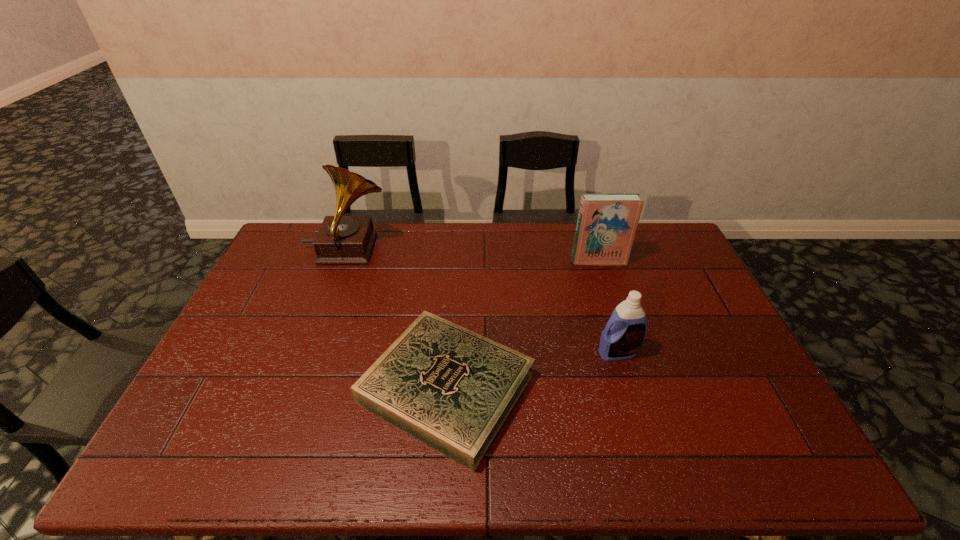
At what (x,y) coordinates should I click in order to perform the action: click on vacant region at the far right corner of the desktop. Please return your answer as a coordinate pair (x, y). Looking at the image, I should click on (x=656, y=244).

Locate an element on the screen. blank region between the third tallest object and the farther hardback book is located at coordinates (x=608, y=307).

I want to click on free space that is in between the farther hardback book and the second shortest object, so click(x=608, y=307).

Locate an element on the screen. Image resolution: width=960 pixels, height=540 pixels. free space between the shorter hardback book and the right hardback book is located at coordinates (522, 325).

At what (x,y) coordinates should I click in order to perform the action: click on vacant point located between the right hardback book and the shortest object. Please return your answer as a coordinate pair (x, y). Image resolution: width=960 pixels, height=540 pixels. Looking at the image, I should click on (522, 325).

Image resolution: width=960 pixels, height=540 pixels. Identify the location of free space that is in between the leftmost object and the left hardback book. (396, 319).

Where is `vacant region between the leftmost object and the detergent`? Image resolution: width=960 pixels, height=540 pixels. vacant region between the leftmost object and the detergent is located at coordinates (482, 301).

Locate an element on the screen. free area in between the detergent and the tallest object is located at coordinates (482, 301).

The image size is (960, 540). Identify the location of vacant region between the tallest object and the detergent. (482, 301).

Find the location of a particular element. Image resolution: width=960 pixels, height=540 pixels. vacant area between the tallest object and the shorter hardback book is located at coordinates (396, 319).